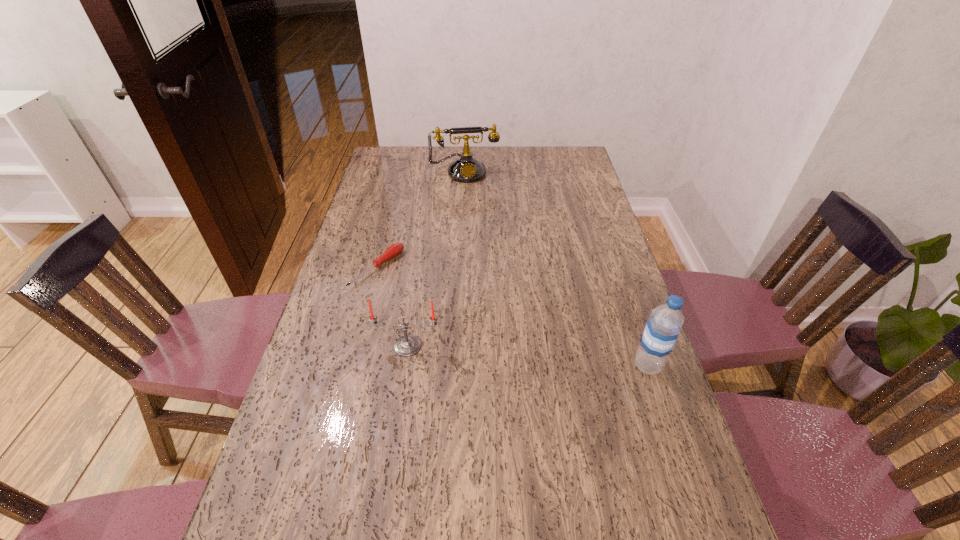
Locate an element on the screen. vacant area situated 0.200m at the tip of the third nearest object is located at coordinates (444, 309).

You are a GUI agent. You are given a task and a screenshot of the screen. Output one action in this format:
    pyautogui.click(x=<x>, y=<y>)
    Task: Click on the vacant space located 0.310m at the tip of the third nearest object
    
    Given the screenshot: What is the action you would take?
    pyautogui.click(x=475, y=327)

Identify the location of vacant space located 0.310m on the dial of the telephone. The image size is (960, 540). (476, 230).

Find the location of a particular element. Image resolution: width=960 pixels, height=540 pixels. vacant region located 0.060m on the dial of the telephone is located at coordinates (469, 191).

Image resolution: width=960 pixels, height=540 pixels. Find the location of `free space located on the dial of the telephone`. free space located on the dial of the telephone is located at coordinates (469, 193).

Where is `object at the far edge`? The height and width of the screenshot is (540, 960). object at the far edge is located at coordinates (466, 169).

Where is `object that is positioned at the left edge`? This screenshot has width=960, height=540. object that is positioned at the left edge is located at coordinates (394, 250).

Image resolution: width=960 pixels, height=540 pixels. What are the coordinates of `object located at the right edge` in the screenshot? It's located at (663, 326).

What are the coordinates of `vacant region at the far edge of the desktop` in the screenshot? It's located at (425, 151).

Where is `vacant region at the near edge of the desktop`? This screenshot has width=960, height=540. vacant region at the near edge of the desktop is located at coordinates (493, 508).